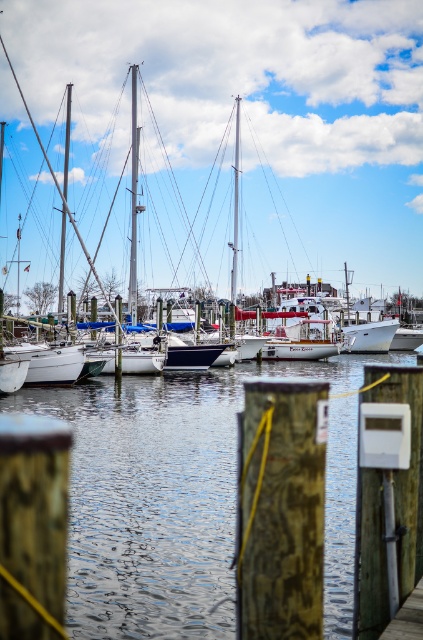
Question: Which point is farther from the camera taking this photo?

Choices:
 (A) (x=145, y=93)
 (B) (x=107, y=401)
 (C) (x=395, y=636)

Answer: (A)

Question: Which point is closer to the camera?

Choices:
 (A) (376, 88)
 (B) (187, 534)
 (C) (420, 611)

Answer: (C)

Question: Is white matte sailboat at left bigger than clear water at center?

Choices:
 (A) yes
 (B) no

Answer: (A)

Question: Is white matte sailboat at left closer to camera compared to wooden dock at lower right?

Choices:
 (A) yes
 (B) no

Answer: (B)

Question: Is clear water at center behind wooden dock at lower right?

Choices:
 (A) yes
 (B) no

Answer: (A)

Question: Which point is farther to the camera?

Choices:
 (A) clear water at center
 (B) wooden dock at lower right

Answer: (A)